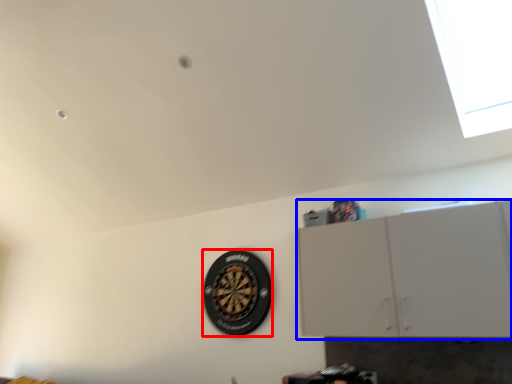
Question: Which point is further to the camera, wheel (highlighted by a red box) or cabinetry (highlighted by a blue box)?

Choices:
 (A) wheel
 (B) cabinetry

Answer: (A)